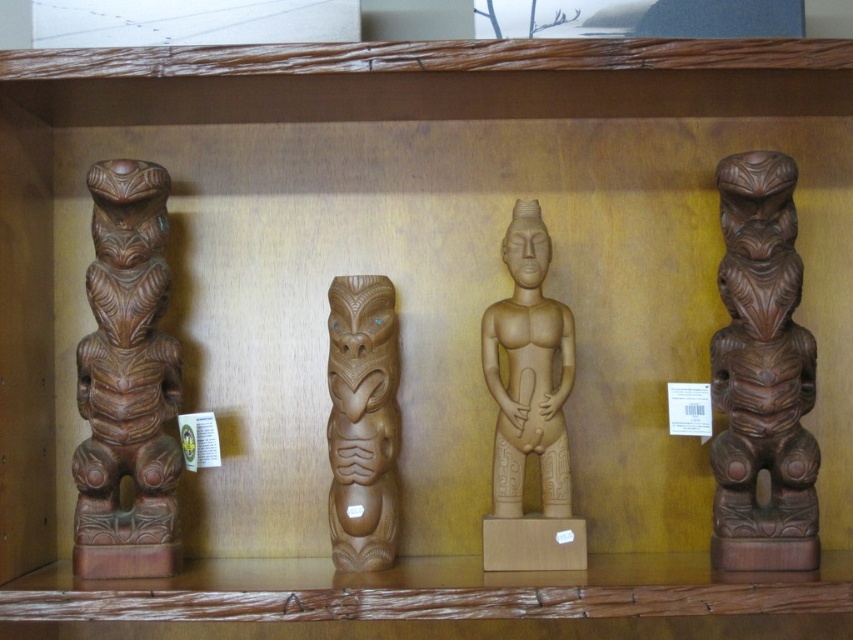
How distant is brown wood totem pole at left from brown polished wood totem at left?

15.46 centimeters

Is point (778, 326) in front of point (141, 333)?

Yes, point (778, 326) is closer to viewer.

Identify the location of brown wood totem pole at left. The width and height of the screenshot is (853, 640). [758, 378].

Can you confirm if brown wood carving at right is wider than brown wood carving at center?

Correct, the width of brown wood carving at right exceeds that of brown wood carving at center.

Can you confirm if brown wood carving at right is positioned below brown wood carving at center?

No.

Where is `brown wood carving at right`? This screenshot has height=640, width=853. brown wood carving at right is located at coordinates pos(761,376).

Does brown wood totem pole at left lie in front of light brown wood statue at center?

Yes.

Is brown wood totem pole at left below light brown wood statue at center?

No, brown wood totem pole at left is not below light brown wood statue at center.

The width and height of the screenshot is (853, 640). Identify the location of brown wood totem pole at left. (758, 378).

What are the coordinates of `brown wood totem pole at left` in the screenshot? It's located at (758, 378).